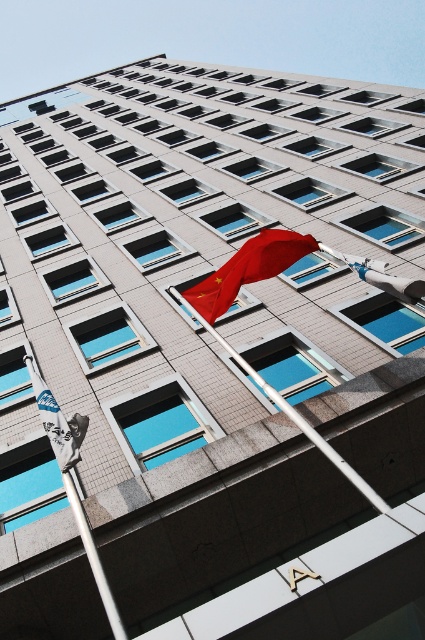
Does silver metallic flag pole at left lie in front of white metallic flag pole at center?

Yes.

Between point (76, 513) and point (354, 476), which one is positioned in front?

Point (354, 476) is in front.

Describe the element at coordinates (73, 481) in the screenshot. I see `silver metallic flag pole at left` at that location.

You are a GUI agent. You are given a task and a screenshot of the screen. Output one action in this format:
    pyautogui.click(x=<x>, y=<y>)
    Task: Click on the silver metallic flag pole at left
    
    Given the screenshot: What is the action you would take?
    pyautogui.click(x=73, y=481)

Can you confirm if red fabric flag at center is positioned above matte red flag at center?

Yes, red fabric flag at center is above matte red flag at center.

Which of these two, red fabric flag at center or matte red flag at center, stands taller?

red fabric flag at center

You are a GUI agent. You are given a task and a screenshot of the screen. Output one action in this format:
    pyautogui.click(x=<x>, y=<y>)
    Task: Click on the red fabric flag at center
    
    Given the screenshot: What is the action you would take?
    coord(248,269)

Where is `red fabric flag at center`? The width and height of the screenshot is (425, 640). red fabric flag at center is located at coordinates (248, 269).

Who is positioned more to the right, red fabric flag at center or blue fabric flag at lower left?

red fabric flag at center is more to the right.

Who is more distant from viewer, (272, 257) or (53, 449)?

The point (272, 257) is behind.

Identify the location of red fabric flag at center. The image size is (425, 640). (248, 269).